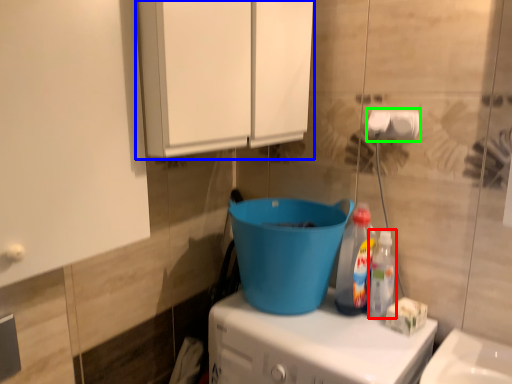
Question: Which object is the closest to the bottle (highlighted by a red box)? Choose among these: cabinetry (highlighted by a blue box) or toilet paper (highlighted by a green box).

Choices:
 (A) cabinetry
 (B) toilet paper

Answer: (B)